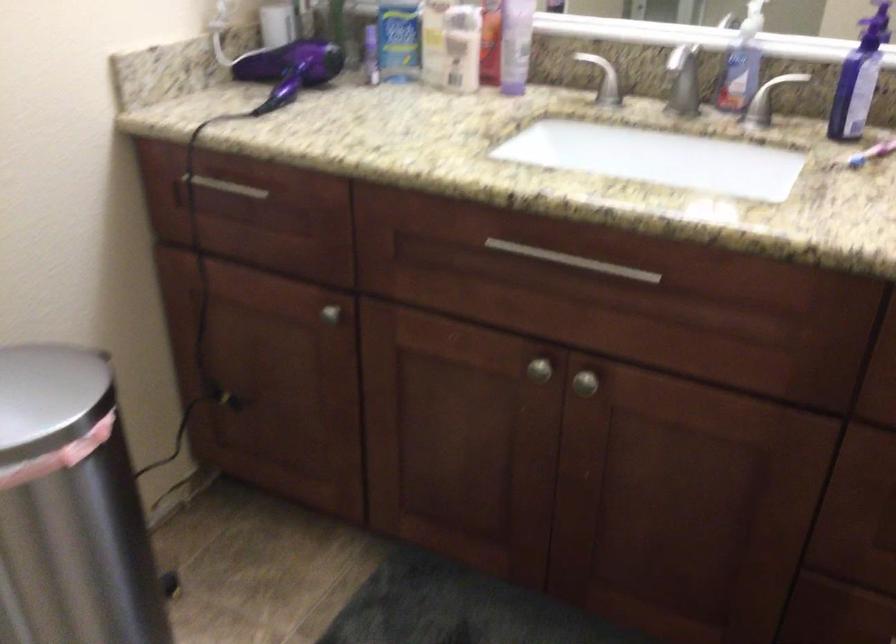
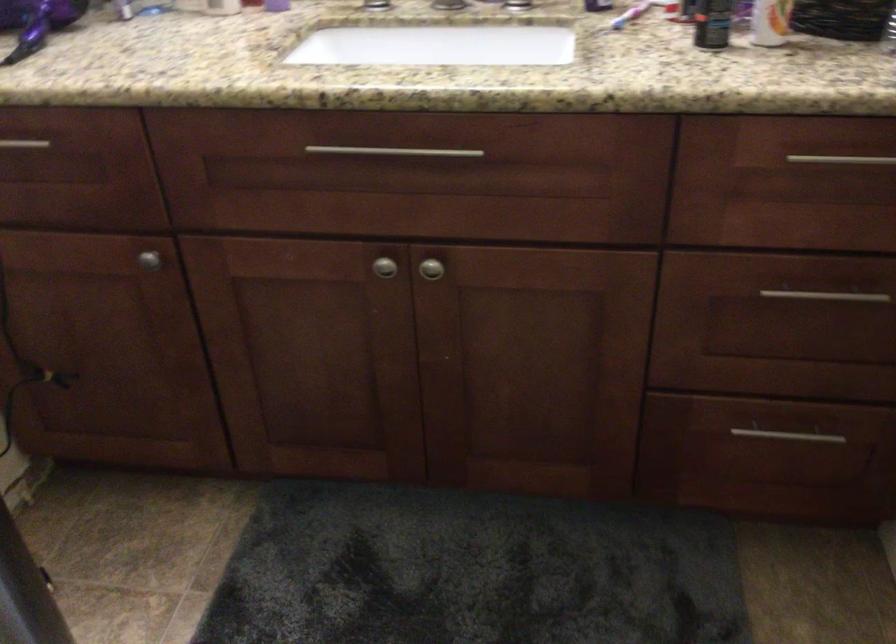
Locate, in the second image, the point that corresponds to (x=289, y=80) in the first image.

(37, 22)